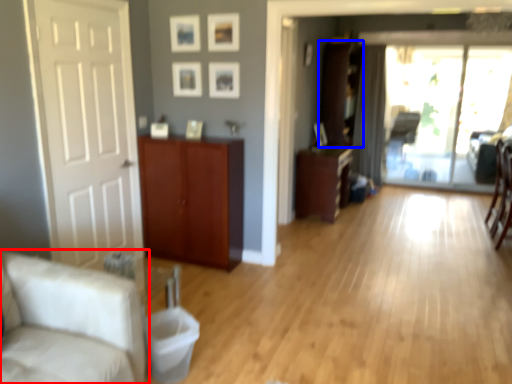
Question: Which object is closer to the camera taking this photo, studio couch (highlighted by a red box) or cabinetry (highlighted by a blue box)?

Choices:
 (A) studio couch
 (B) cabinetry

Answer: (A)